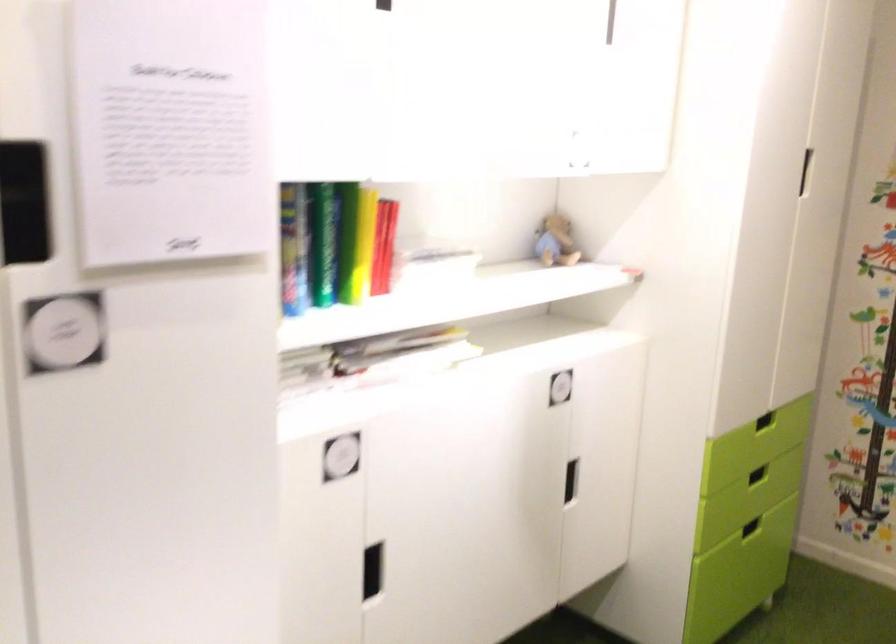
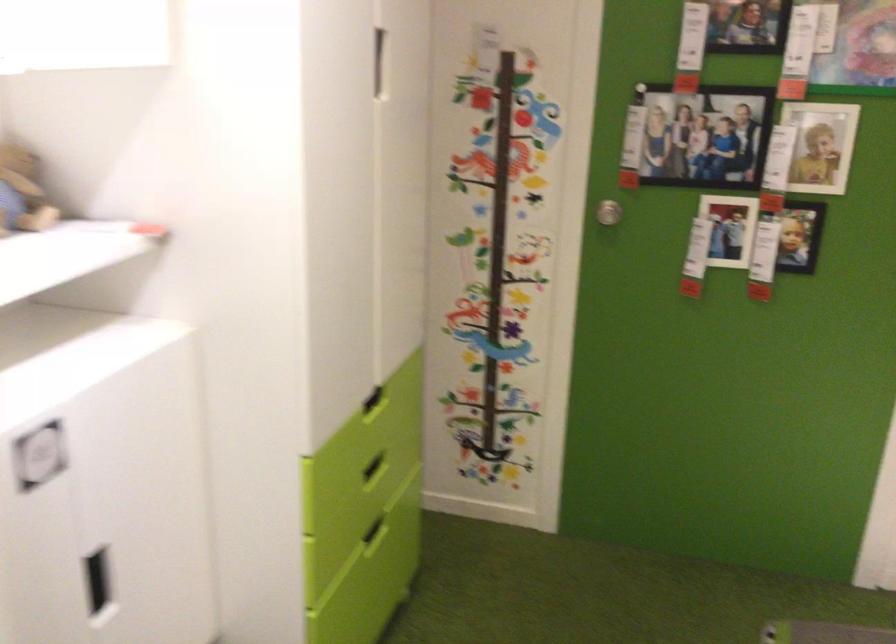
Find the pixel in the second image that matches (x=771, y=431) in the first image.

(373, 401)